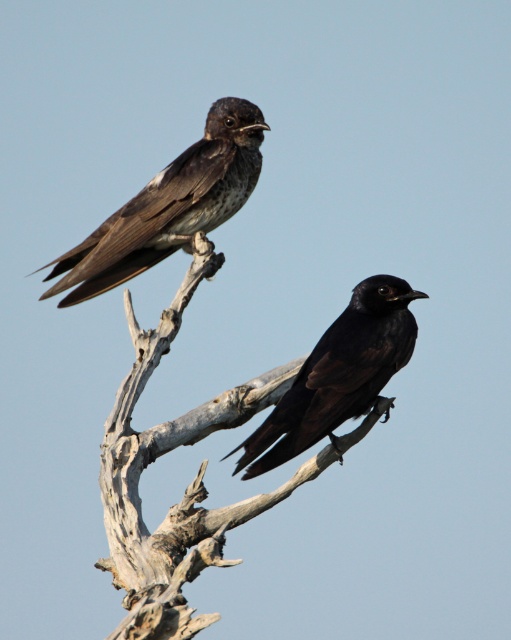
Who is more distant from viewer, (164, 636) or (311, 419)?

Positioned behind is point (311, 419).

Who is more forward, [216,266] or [350,330]?

Point [350,330]

The image size is (511, 640). What are the coordinates of `brown wood branch at upper center` in the screenshot? It's located at click(x=192, y=481).

Can you confirm if brown wood branch at upper center is wider than shiny black bird at upper left?

Indeed, brown wood branch at upper center has a greater width compared to shiny black bird at upper left.

Does brown wood branch at upper center have a greater height compared to shiny black bird at upper left?

Yes, brown wood branch at upper center is taller than shiny black bird at upper left.

Is point (146, 538) farther from camera compared to point (133, 196)?

No, it is not.

This screenshot has width=511, height=640. Identify the location of brown wood branch at upper center. (192, 481).

Can you confirm if shiny black bird at upper left is shorter than shiny black bird at center?

No.

Who is higher up, shiny black bird at upper left or shiny black bird at center?

shiny black bird at upper left

What do you see at coordinates (171, 205) in the screenshot? I see `shiny black bird at upper left` at bounding box center [171, 205].

The width and height of the screenshot is (511, 640). In order to click on shiny black bird at upper left in this screenshot , I will do `click(171, 205)`.